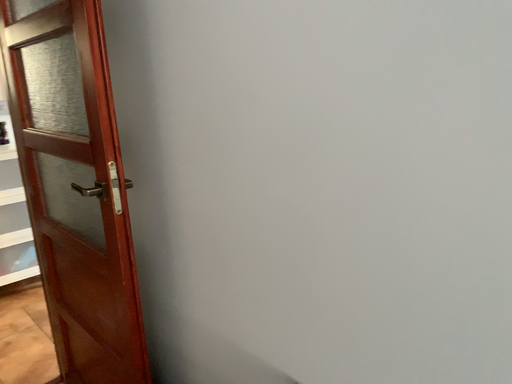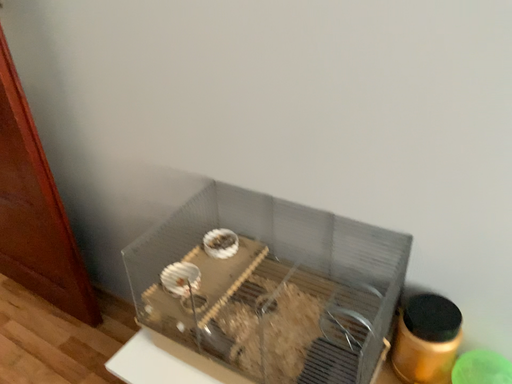
Question: Which way did the camera rotate in the video?

Choices:
 (A) rotated upward
 (B) rotated downward

Answer: (B)